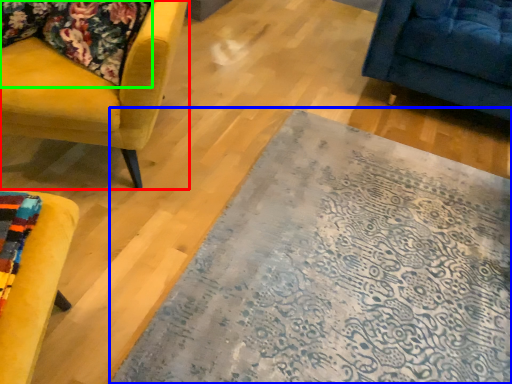
Question: Which object is the closest to the chair (highlighted by a red box)? Choose among these: mat (highlighted by a blue box) or fabric (highlighted by a green box).

Choices:
 (A) mat
 (B) fabric

Answer: (B)